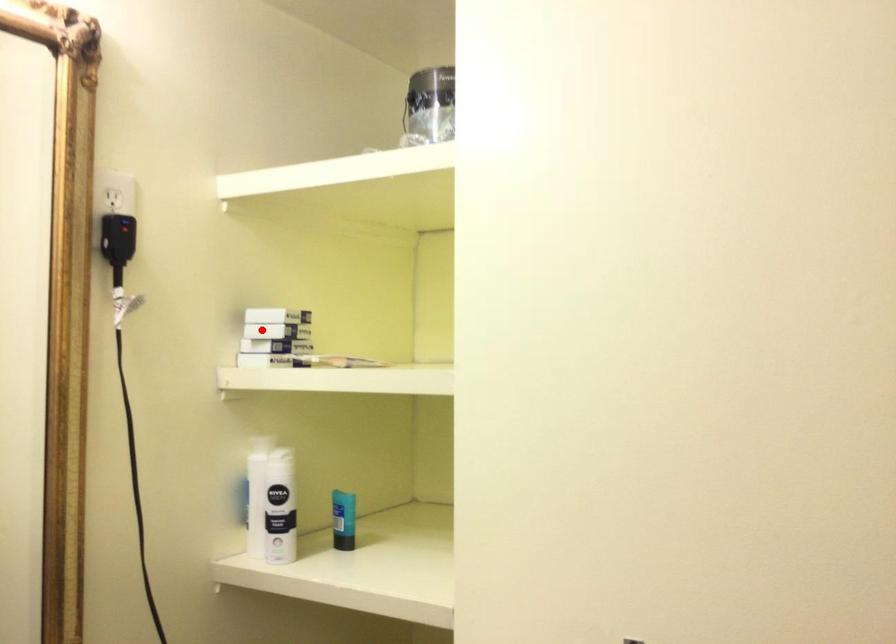
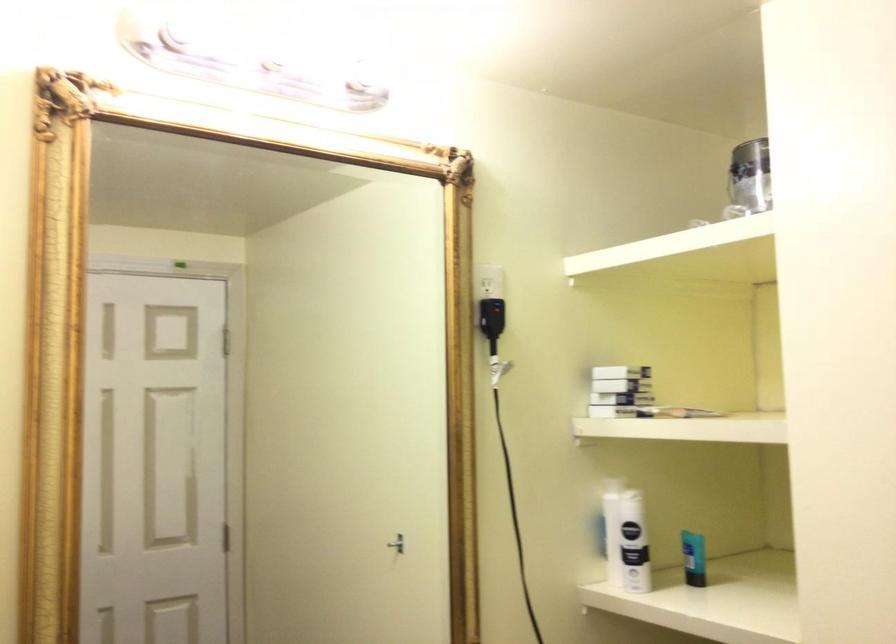
Find the pixel in the second image that matches the highlighted location in the first image.

(617, 386)